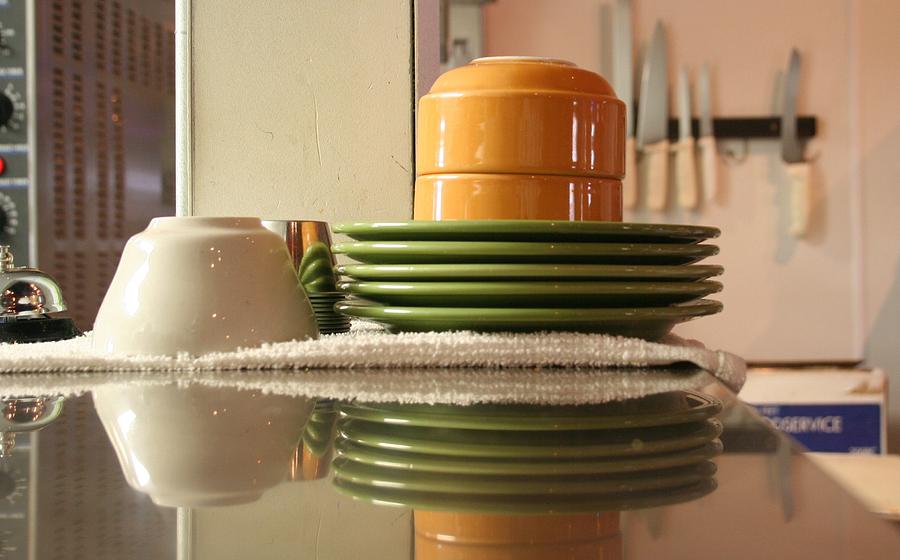
Where is `reflection of plates`? The image size is (900, 560). reflection of plates is located at coordinates (537, 430), (537, 452), (538, 468), (538, 485), (538, 507).